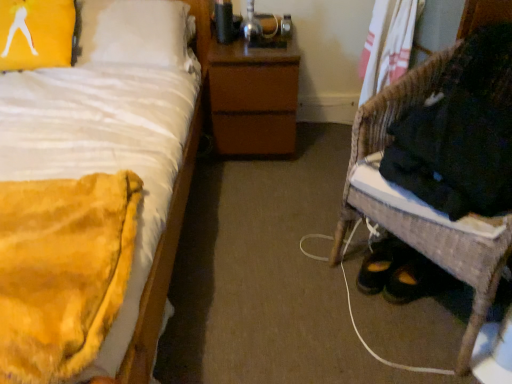
This screenshot has height=384, width=512. Find the location of `free space to the left of woven wicker chair at lower right`. free space to the left of woven wicker chair at lower right is located at coordinates (286, 277).